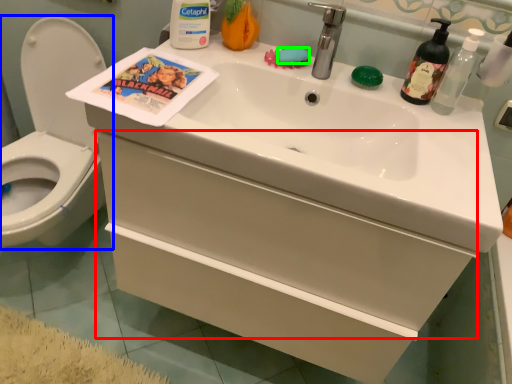
Question: Considering the real-world distances, which object is closest to drawer (highlighted by a red box)? toilet (highlighted by a blue box) or soap (highlighted by a green box).

Choices:
 (A) toilet
 (B) soap

Answer: (B)